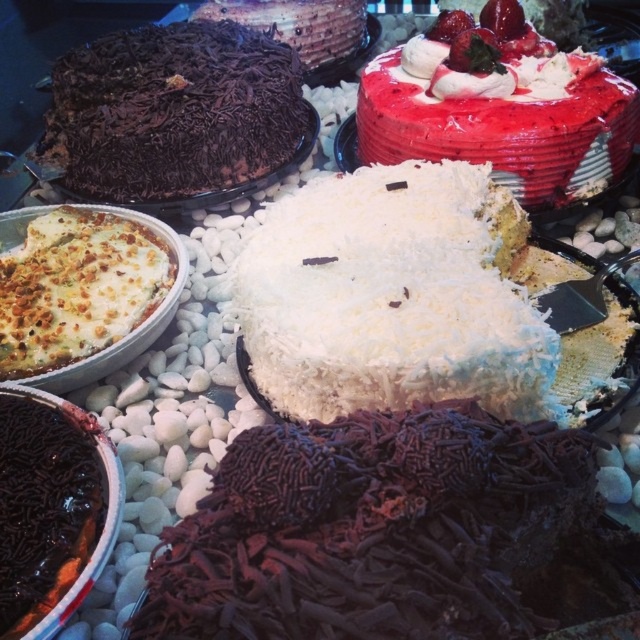
Question: Can you confirm if dark chocolate cake at upper left is positioned above smooth red frosting cake at upper right?

Choices:
 (A) no
 (B) yes

Answer: (B)

Question: Is white coconut cake at center below dark chocolate cake at upper left?

Choices:
 (A) yes
 (B) no

Answer: (A)

Question: Which point appears closest to the camera in this image?

Choices:
 (A) (77, 148)
 (B) (433, 348)

Answer: (B)

Question: Which point is farther to the camera?

Choices:
 (A) white coconut cake at center
 (B) dark chocolate cake at upper left

Answer: (B)

Question: Does white coconut cake at center appear over chocolate shavings cake at upper center?

Choices:
 (A) yes
 (B) no

Answer: (B)

Question: Considering the real-world distances, which object is farthest from the smooth red frosting cake at upper right?

Choices:
 (A) dark chocolate cake at upper left
 (B) white coconut cake at center

Answer: (A)